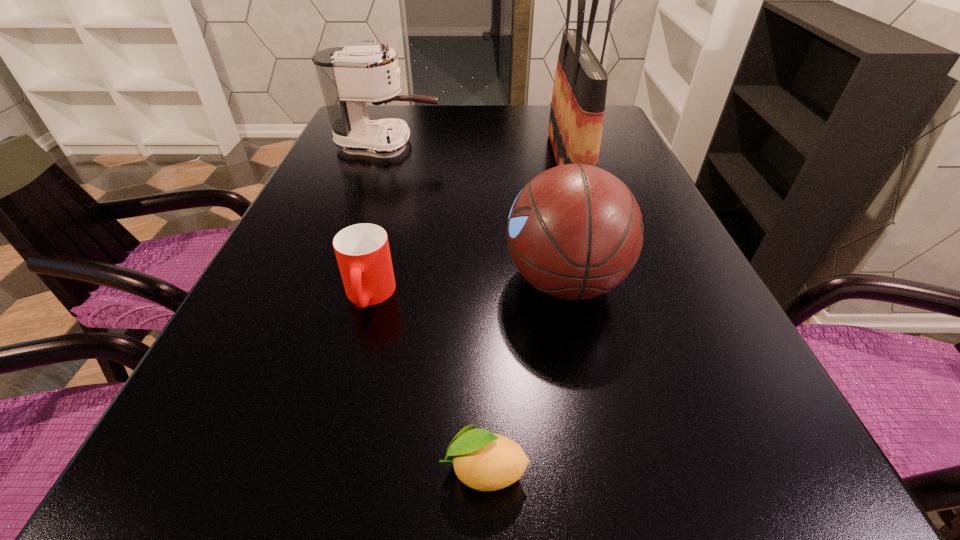
You are a GUI agent. You are given a task and a screenshot of the screen. Output one action in this format:
    pyautogui.click(x=<x>, y=<y>)
    Task: Click on the vacant space that satisfies the following two spatial constraints: 1. on the front side of the basketball; 2. with leaves positioned above the nearest object
    The image size is (960, 540).
    Given the screenshot: What is the action you would take?
    pyautogui.click(x=605, y=469)